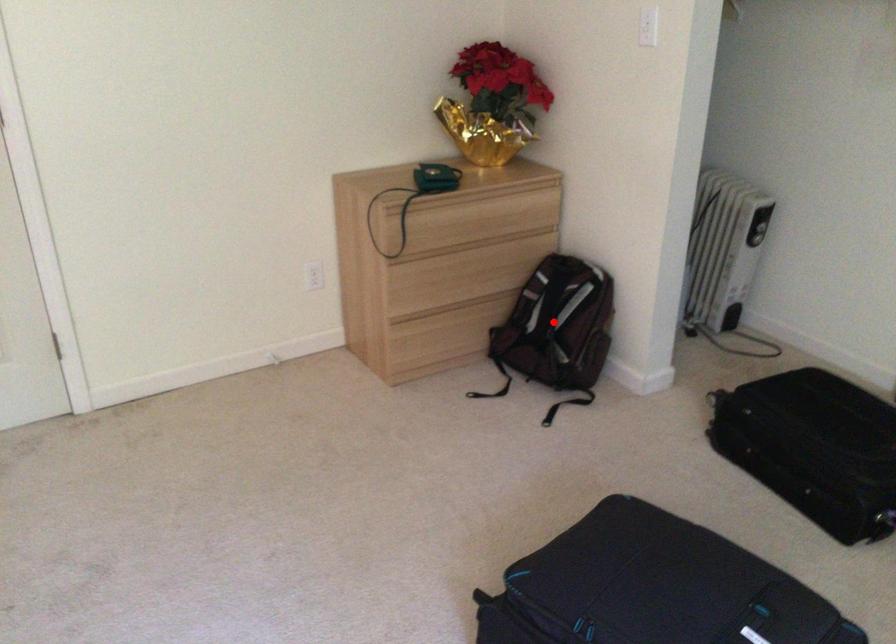
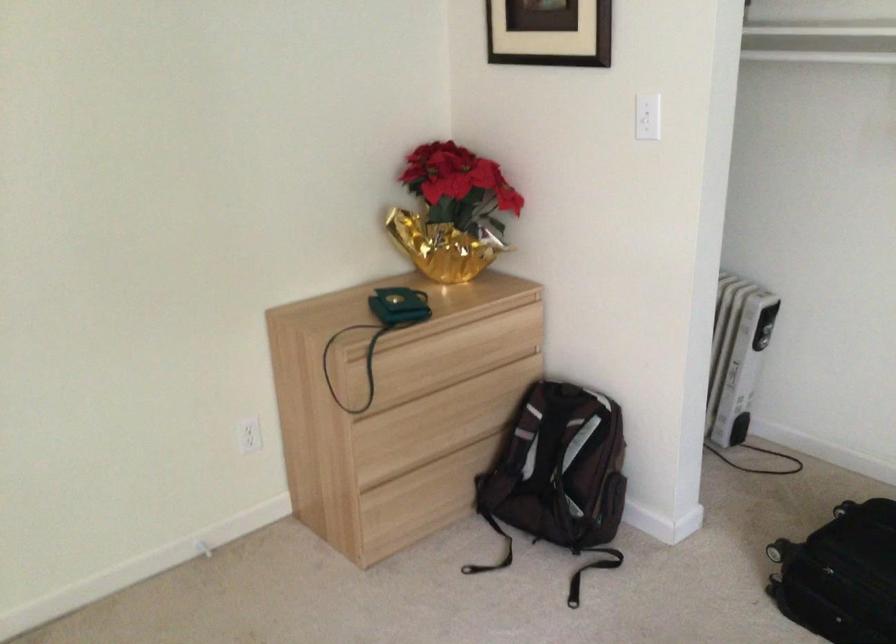
Question: A red point is marked in image1. In image2, is the corresponding 3D point closer to the camera or farther? Reply with the corresponding letter.

Choices:
 (A) The corresponding 3D point is closer.
 (B) The corresponding 3D point is farther.

Answer: (A)